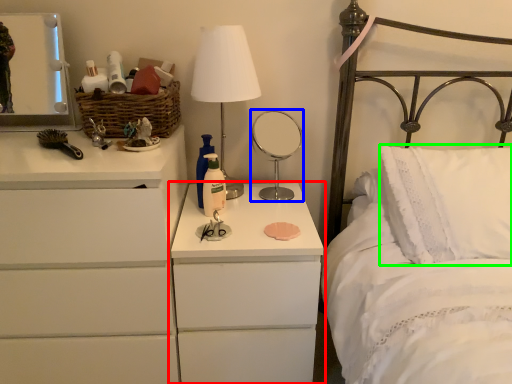
Question: Which object is the farthest from nightstand (highlighted by a red box)? Choose among these: mirror (highlighted by a blue box) or pillow (highlighted by a green box).

Choices:
 (A) mirror
 (B) pillow

Answer: (A)